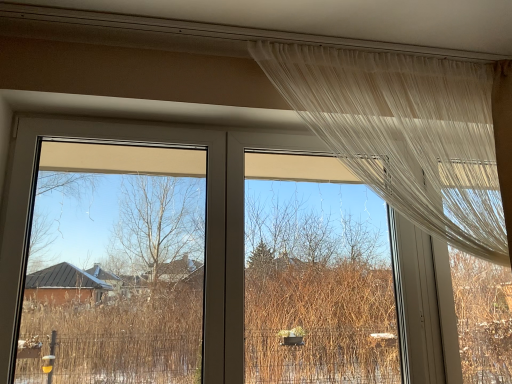
What do you see at coordinates (404, 133) in the screenshot?
I see `sheer white curtain at upper right` at bounding box center [404, 133].

What do you see at coordinates (115, 266) in the screenshot? The image size is (512, 384). I see `transparent plastic window screen at left, which is the first window screen in left-to-right order` at bounding box center [115, 266].

This screenshot has height=384, width=512. Find the location of `sheer white curtain at upper right`. sheer white curtain at upper right is located at coordinates (404, 133).

From the image's perspective, is transparent fabric at upper center, placed as the second window screen when sorted from left to right, above transparent plastic window screen at left, which is the first window screen in left-to-right order?

No.

How different are the orientations of transparent fabric at upper center, positioned as the 1th window screen in right-to-left order, and transparent plastic window screen at left, which is the first window screen in left-to-right order, in degrees?

The facing directions of transparent fabric at upper center, positioned as the 1th window screen in right-to-left order, and transparent plastic window screen at left, which is the first window screen in left-to-right order, are 0.000753 degrees apart.

Is transparent fabric at upper center, positioned as the 1th window screen in right-to-left order, inside or outside of transparent plastic window screen at left, which is the first window screen in left-to-right order?

The correct answer is: outside.

Does point (365, 339) come in front of point (52, 155)?

That is False.

Are transparent plastic window screen at left, which is the first window screen in left-to-right order, and sheer white curtain at upper right making contact?

No, transparent plastic window screen at left, which is the first window screen in left-to-right order, is not making contact with sheer white curtain at upper right.

Considering the positions of objects transparent plastic window screen at left, the 2th window screen positioned from the right, and sheer white curtain at upper right in the image provided, who is more to the right, transparent plastic window screen at left, the 2th window screen positioned from the right, or sheer white curtain at upper right?

sheer white curtain at upper right is more to the right.

At what (x,y) coordinates should I click in order to perform the action: click on the 1st window screen located beneath the sheer white curtain at upper right (from a real-world perspective). Please return your answer as a coordinate pair (x, y). This screenshot has width=512, height=384. Looking at the image, I should click on (115, 266).

Is transparent plastic window screen at left, which is the first window screen in left-to-right order, surrounding sheer white curtain at upper right?

No, sheer white curtain at upper right is not a part of transparent plastic window screen at left, which is the first window screen in left-to-right order.

Is transparent plastic window screen at left, which is the first window screen in left-to-right order, with transparent fabric at upper center, positioned as the 1th window screen in right-to-left order?

No.

From a real-world perspective, is transparent plastic window screen at left, the 2th window screen positioned from the right, positioned over transparent fabric at upper center, positioned as the 1th window screen in right-to-left order, based on gravity?

Correct, in the physical world, transparent plastic window screen at left, the 2th window screen positioned from the right, is higher than transparent fabric at upper center, positioned as the 1th window screen in right-to-left order.

Is transparent plastic window screen at left, the 2th window screen positioned from the right, further to camera compared to transparent fabric at upper center, placed as the second window screen when sorted from left to right?

No, it is not.

Can you confirm if transparent plastic window screen at left, the 2th window screen positioned from the right, is positioned to the right of transparent fabric at upper center, placed as the second window screen when sorted from left to right?

No, transparent plastic window screen at left, the 2th window screen positioned from the right, is not to the right of transparent fabric at upper center, placed as the second window screen when sorted from left to right.

In terms of height, does transparent fabric at upper center, positioned as the 1th window screen in right-to-left order, look taller or shorter compared to sheer white curtain at upper right?

In the image, transparent fabric at upper center, positioned as the 1th window screen in right-to-left order, appears to be taller than sheer white curtain at upper right.

Are transparent fabric at upper center, positioned as the 1th window screen in right-to-left order, and sheer white curtain at upper right located far from each other?

transparent fabric at upper center, positioned as the 1th window screen in right-to-left order, is near sheer white curtain at upper right, not far away.

Considering the sizes of objects transparent fabric at upper center, placed as the second window screen when sorted from left to right, and sheer white curtain at upper right in the image provided, who is bigger, transparent fabric at upper center, placed as the second window screen when sorted from left to right, or sheer white curtain at upper right?

With larger size is sheer white curtain at upper right.

From a real-world perspective, is transparent fabric at upper center, positioned as the 1th window screen in right-to-left order, physically located above or below sheer white curtain at upper right?

In terms of real-world spatial position, transparent fabric at upper center, positioned as the 1th window screen in right-to-left order, is below sheer white curtain at upper right.

Is transparent fabric at upper center, positioned as the 1th window screen in right-to-left order, inside sheer white curtain at upper right?

No.

How many degrees apart are the facing directions of sheer white curtain at upper right and transparent fabric at upper center, placed as the second window screen when sorted from left to right?

0.394 degrees separate the facing orientations of sheer white curtain at upper right and transparent fabric at upper center, placed as the second window screen when sorted from left to right.

Based on the photo, in terms of size, does sheer white curtain at upper right appear bigger or smaller than transparent fabric at upper center, placed as the second window screen when sorted from left to right?

In the image, sheer white curtain at upper right appears to be larger than transparent fabric at upper center, placed as the second window screen when sorted from left to right.

From a real-world perspective, which is physically above, sheer white curtain at upper right or transparent fabric at upper center, placed as the second window screen when sorted from left to right?

From a 3D spatial view, sheer white curtain at upper right is above.

Who is smaller, sheer white curtain at upper right or transparent plastic window screen at left, the 2th window screen positioned from the right?

Smaller between the two is sheer white curtain at upper right.

Is point (404, 203) closer or farther from the camera than point (87, 234)?

Point (404, 203) is positioned closer to the camera compared to point (87, 234).

From the image's perspective, is sheer white curtain at upper right located beneath transparent plastic window screen at left, the 2th window screen positioned from the right?

Incorrect, from the image's perspective, sheer white curtain at upper right is higher than transparent plastic window screen at left, the 2th window screen positioned from the right.

I want to click on window screen above the transparent fabric at upper center, positioned as the 1th window screen in right-to-left order (from a real-world perspective), so [115, 266].

Locate an element on the screen. This screenshot has width=512, height=384. curtain that is on the right side of transparent plastic window screen at left, which is the first window screen in left-to-right order is located at coordinates (404, 133).

Based on the photo, estimate the real-world distances between objects in this image. Which object is further from transparent plastic window screen at left, which is the first window screen in left-to-right order, sheer white curtain at upper right or transparent fabric at upper center, placed as the second window screen when sorted from left to right?

The object further to transparent plastic window screen at left, which is the first window screen in left-to-right order, is sheer white curtain at upper right.

Estimate the real-world distances between objects in this image. Which object is further from sheer white curtain at upper right, transparent plastic window screen at left, the 2th window screen positioned from the right, or transparent fabric at upper center, positioned as the 1th window screen in right-to-left order?

transparent plastic window screen at left, the 2th window screen positioned from the right.

Looking at the image, which one is located further to transparent plastic window screen at left, the 2th window screen positioned from the right, transparent fabric at upper center, placed as the second window screen when sorted from left to right, or sheer white curtain at upper right?

The object further to transparent plastic window screen at left, the 2th window screen positioned from the right, is sheer white curtain at upper right.

From the image, which object appears to be nearer to transparent fabric at upper center, positioned as the 1th window screen in right-to-left order, transparent plastic window screen at left, the 2th window screen positioned from the right, or sheer white curtain at upper right?

The object closer to transparent fabric at upper center, positioned as the 1th window screen in right-to-left order, is sheer white curtain at upper right.

Consider the image. Which object lies further to the anchor point sheer white curtain at upper right, transparent fabric at upper center, positioned as the 1th window screen in right-to-left order, or transparent plastic window screen at left, the 2th window screen positioned from the right?

transparent plastic window screen at left, the 2th window screen positioned from the right, is positioned further to the anchor sheer white curtain at upper right.

Which object lies further to the anchor point transparent fabric at upper center, placed as the second window screen when sorted from left to right, sheer white curtain at upper right or transparent plastic window screen at left, which is the first window screen in left-to-right order?

transparent plastic window screen at left, which is the first window screen in left-to-right order, is further to transparent fabric at upper center, placed as the second window screen when sorted from left to right.

The image size is (512, 384). I want to click on window screen situated between transparent plastic window screen at left, which is the first window screen in left-to-right order, and sheer white curtain at upper right from left to right, so click(x=316, y=273).